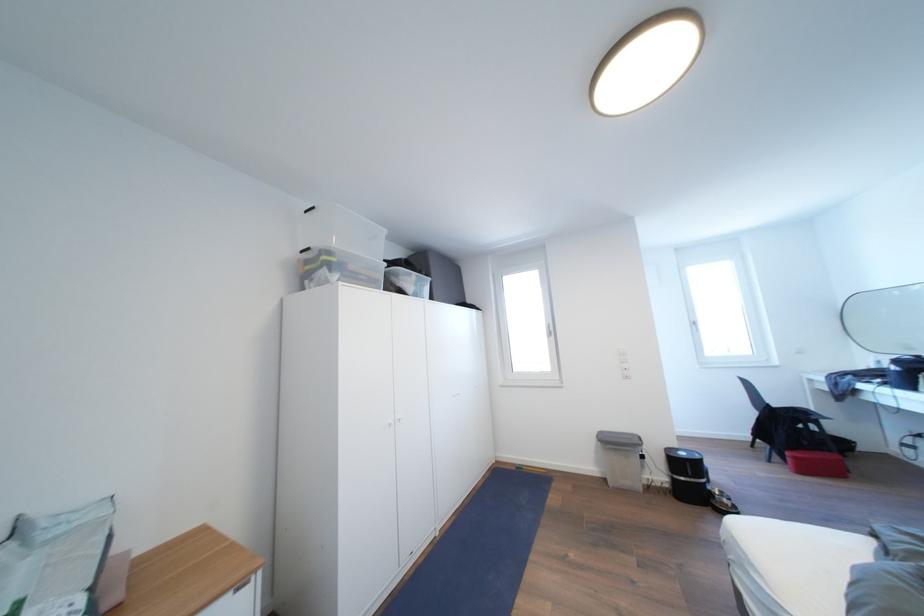
This screenshot has width=924, height=616. Find the location of `grey trash can lid`. grey trash can lid is located at coordinates (622, 440).